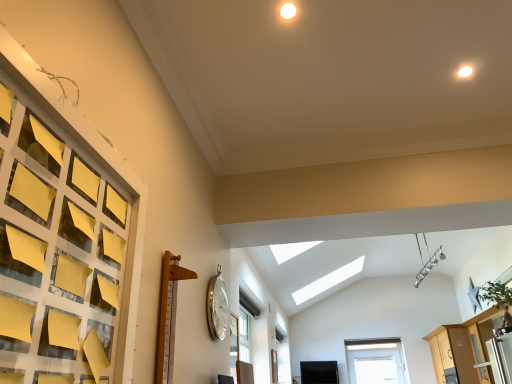
Question: Is wooden dresser at lower right bigger or smaller than silver metallic clock at upper center?

Choices:
 (A) small
 (B) big

Answer: (B)

Question: From the image's perspective, is wooden dresser at lower right located above or below silver metallic clock at upper center?

Choices:
 (A) below
 (B) above

Answer: (A)

Question: From a real-world perspective, is wooden dresser at lower right above or below silver metallic clock at upper center?

Choices:
 (A) above
 (B) below

Answer: (B)

Question: Considering the positions of silver metallic clock at upper center and wooden dresser at lower right in the image, is silver metallic clock at upper center taller or shorter than wooden dresser at lower right?

Choices:
 (A) tall
 (B) short

Answer: (B)

Question: From a real-world perspective, is silver metallic clock at upper center physically located above or below wooden dresser at lower right?

Choices:
 (A) below
 (B) above

Answer: (B)

Question: In terms of width, does silver metallic clock at upper center look wider or thinner when compared to wooden dresser at lower right?

Choices:
 (A) wide
 (B) thin

Answer: (B)

Question: From the image's perspective, is silver metallic clock at upper center positioned above or below wooden dresser at lower right?

Choices:
 (A) above
 (B) below

Answer: (A)